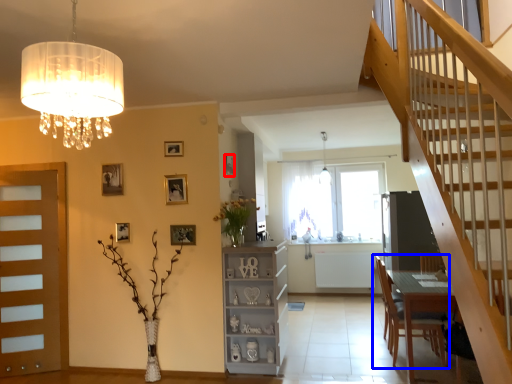
Question: Which object appears closest to the camera in this image, picture frame (highlighted by a red box) or chair (highlighted by a blue box)?

Choices:
 (A) picture frame
 (B) chair

Answer: (B)